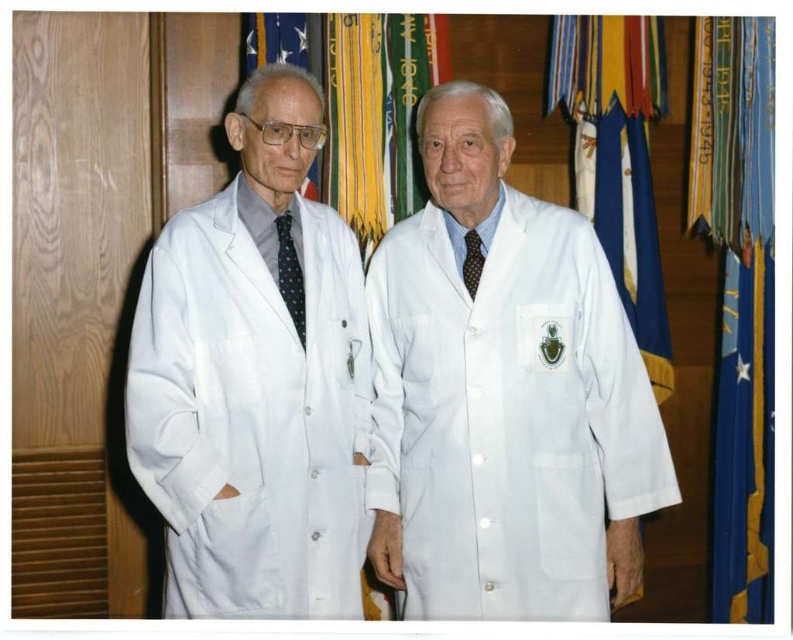
Question: Which object appears closest to the camera in this image?

Choices:
 (A) brown dotted tie at center
 (B) blue fabric flag at center
 (C) dark blue dotted tie at center

Answer: (C)

Question: Which is nearer to the white matte lab coat at center?

Choices:
 (A) blue fabric flag at center
 (B) dark blue dotted tie at center
 (C) white lab coat at center
 (D) white matte lab coat at left

Answer: (C)

Question: Which of the following is the farthest from the observer?

Choices:
 (A) (282, 248)
 (B) (474, 241)
 (C) (598, 572)
 (D) (611, 456)

Answer: (B)

Question: Where is white lab coat at center located in relation to brown dotted tie at center in the image?

Choices:
 (A) left
 (B) right

Answer: (A)

Question: Considering the relative positions of white matte lab coat at left and dark blue dotted tie at center in the image provided, where is white matte lab coat at left located with respect to dark blue dotted tie at center?

Choices:
 (A) below
 (B) above

Answer: (A)

Question: Does white lab coat at center lie behind white matte lab coat at left?

Choices:
 (A) yes
 (B) no

Answer: (A)